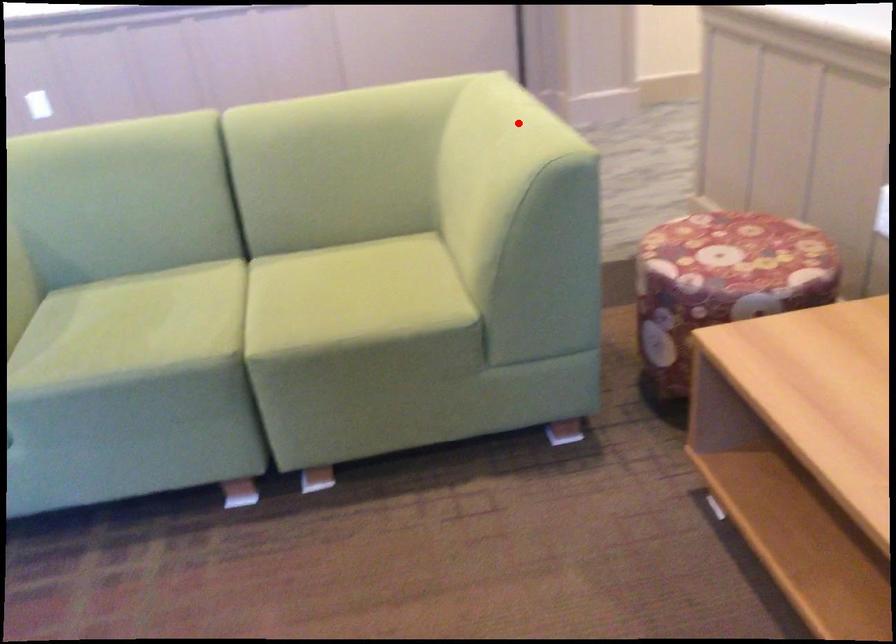
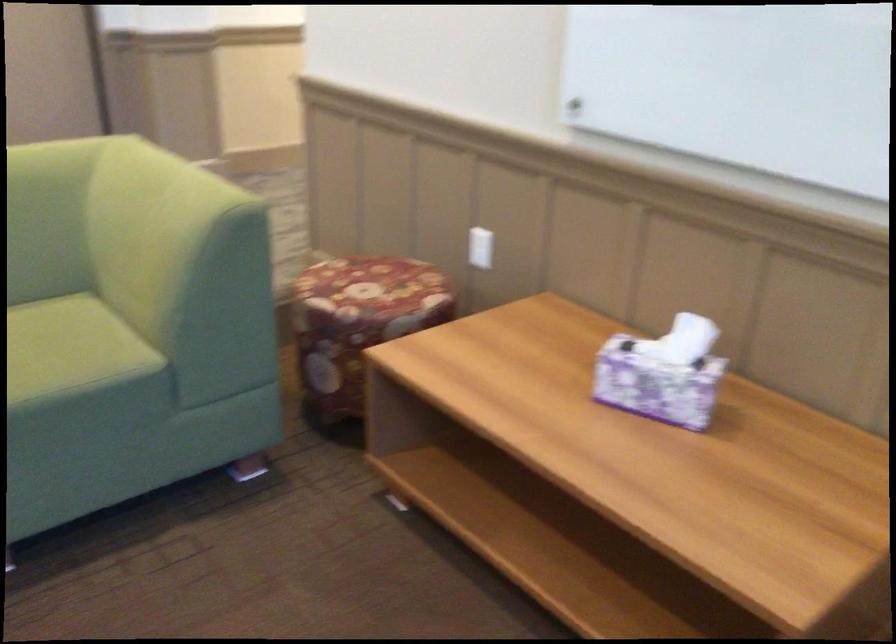
The point at the highlighted location is marked in the first image. Where is the corresponding point in the second image?

(181, 184)